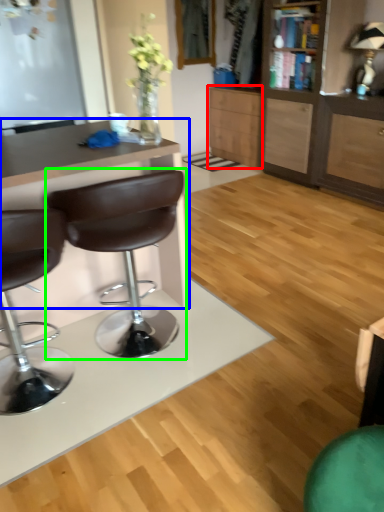
Question: Considering the real-world distances, which object is closest to cabinetry (highlighted by a red box)? desk (highlighted by a blue box) or chair (highlighted by a green box).

Choices:
 (A) desk
 (B) chair

Answer: (A)